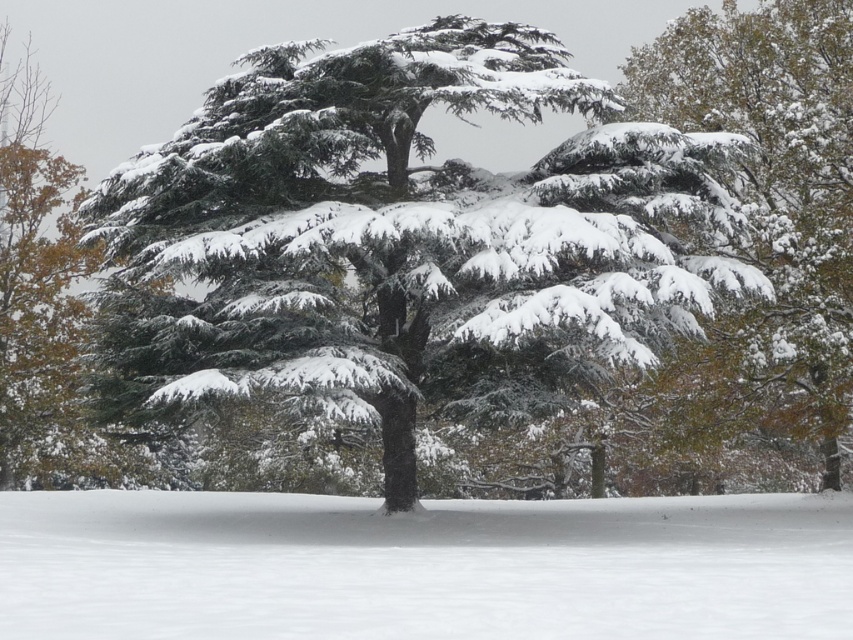
Can you confirm if green matte tree at center is positioned to the right of white fluffy snow at center?

Indeed, green matte tree at center is positioned on the right side of white fluffy snow at center.

Who is more distant from viewer, (480,362) or (537,541)?

The point (480,362) is more distant.

You are a GUI agent. You are given a task and a screenshot of the screen. Output one action in this format:
    pyautogui.click(x=<x>, y=<y>)
    Task: Click on the green matte tree at center
    Image resolution: width=853 pixels, height=640 pixels.
    Given the screenshot: What is the action you would take?
    pyautogui.click(x=410, y=237)

Locate an element on the screen. The image size is (853, 640). green matte tree at center is located at coordinates (410, 237).

Who is positioned more to the left, green matte tree at center or snow-covered evergreen at upper right?

From the viewer's perspective, green matte tree at center appears more on the left side.

Measure the distance between green matte tree at center and snow-covered evergreen at upper right.

They are 6.60 meters apart.

Locate an element on the screen. Image resolution: width=853 pixels, height=640 pixels. green matte tree at center is located at coordinates (410, 237).

The width and height of the screenshot is (853, 640). In order to click on white fluffy snow at center in this screenshot , I will do `click(422, 566)`.

Does white fluffy snow at center have a lesser width compared to snow-covered evergreen at upper right?

No, white fluffy snow at center is not thinner than snow-covered evergreen at upper right.

Is point (517, 541) farther from camera compared to point (724, 17)?

No, (517, 541) is closer to viewer.

Locate an element on the screen. This screenshot has height=640, width=853. white fluffy snow at center is located at coordinates (422, 566).